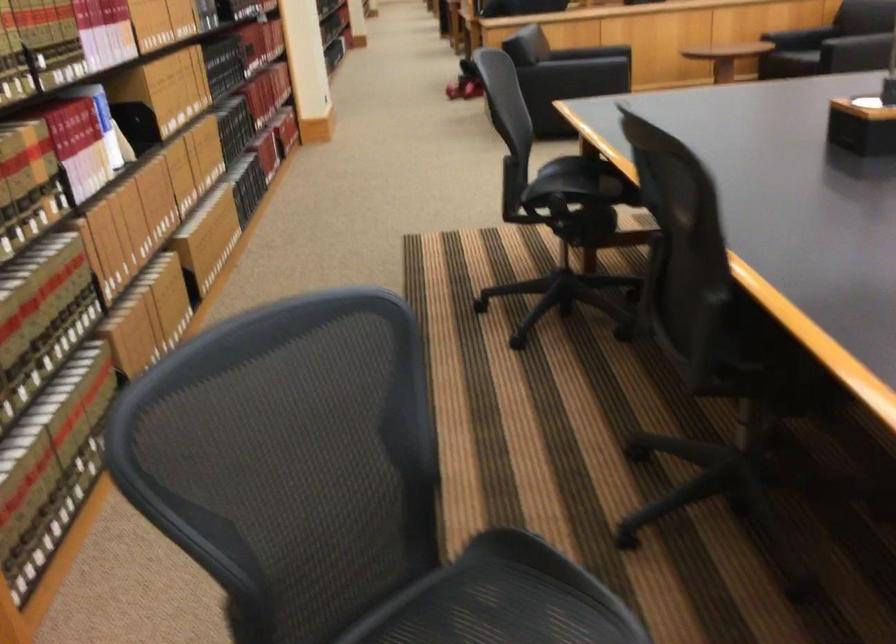
Identify the location of sofa sitting surface. (790, 55).